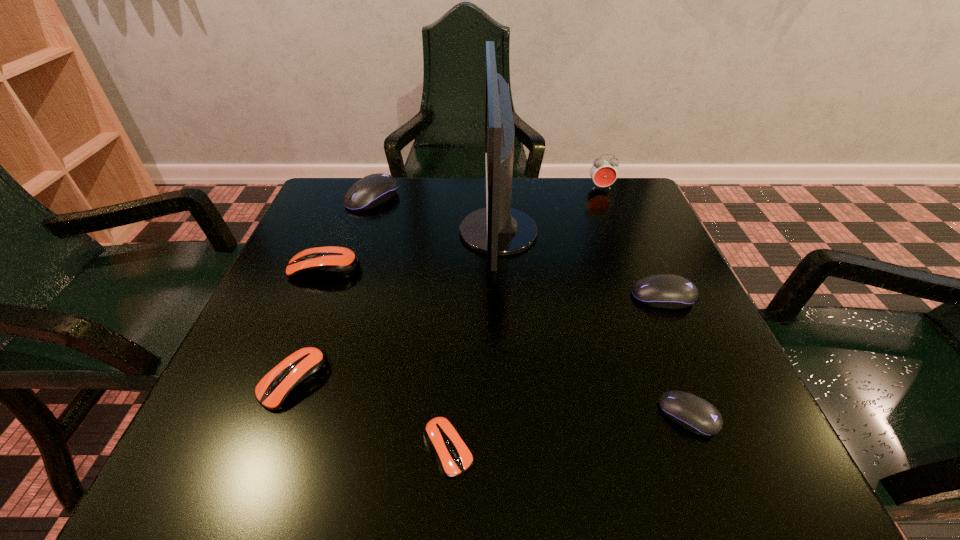
This screenshot has height=540, width=960. I want to click on the smallest black computer mouse, so click(x=696, y=415).

The height and width of the screenshot is (540, 960). I want to click on the shortest computer mouse, so click(441, 435).

Find the location of `the third computer mouse from right to left`. the third computer mouse from right to left is located at coordinates (441, 435).

What are the coordinates of `vacant space located on the screen side of the tallest object` in the screenshot? It's located at (416, 232).

Where is `free space located 0.110m on the screen side of the tallest object`? free space located 0.110m on the screen side of the tallest object is located at coordinates (411, 232).

Where is `free space located on the screen side of the tallest object`? This screenshot has width=960, height=540. free space located on the screen side of the tallest object is located at coordinates (298, 232).

Locate an element on the screen. Image resolution: width=960 pixels, height=540 pixels. vacant area situated 0.100m on the face of the seventh shortest object is located at coordinates 611,213.

This screenshot has height=540, width=960. Find the location of `blank space located 0.150m on the front of the farthest computer mouse`. blank space located 0.150m on the front of the farthest computer mouse is located at coordinates (354, 252).

This screenshot has width=960, height=540. I want to click on free space located 0.300m on the back of the second farthest computer mouse, so click(358, 185).

You are a GUI agent. You are given a task and a screenshot of the screen. Output one action in this format:
    pyautogui.click(x=<x>, y=<y>)
    Task: Click on the free spot located on the left of the second smallest black computer mouse
    The height and width of the screenshot is (540, 960).
    Given the screenshot: What is the action you would take?
    pyautogui.click(x=467, y=297)